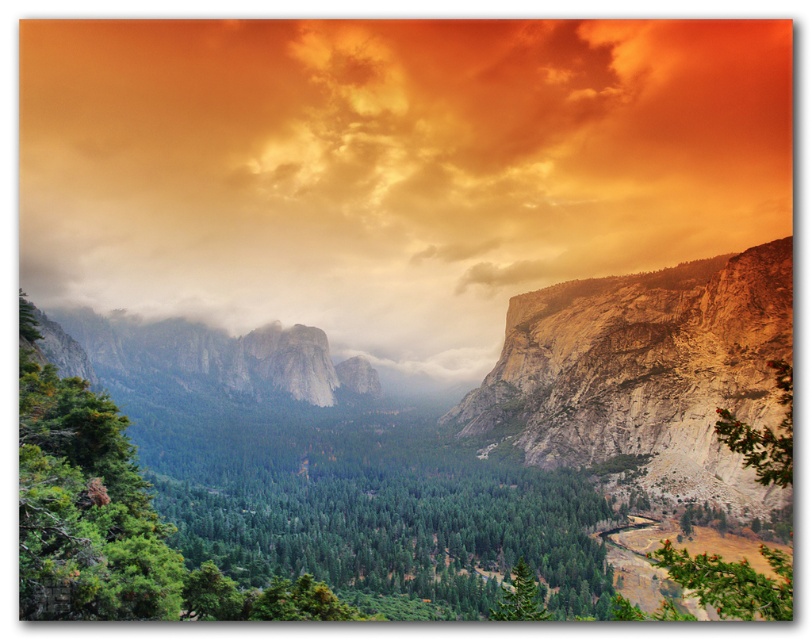
Question: Which point appears closest to the camera in this image?

Choices:
 (A) (644, 465)
 (B) (528, 566)
 (C) (728, 417)

Answer: (B)

Question: Considering the relative positions of orange matte cloud at upper center and green matte tree at right in the image provided, where is orange matte cloud at upper center located with respect to green matte tree at right?

Choices:
 (A) left
 (B) right

Answer: (A)

Question: Which object is closer to the camera taking this photo?

Choices:
 (A) rugged stone cliff at center
 (B) green matte tree at lower left
 (C) green matte tree at right
 (D) green matte tree at lower center

Answer: (C)

Question: Does orange matte cloud at upper center come behind green matte tree at lower center?

Choices:
 (A) no
 (B) yes

Answer: (B)

Question: Which point appears farthest from the camera in this image?

Choices:
 (A) (555, 419)
 (B) (726, 440)
 (C) (720, 320)

Answer: (A)

Question: Does orange matte cloud at upper center appear on the left side of green matte tree at lower left?

Choices:
 (A) no
 (B) yes

Answer: (A)